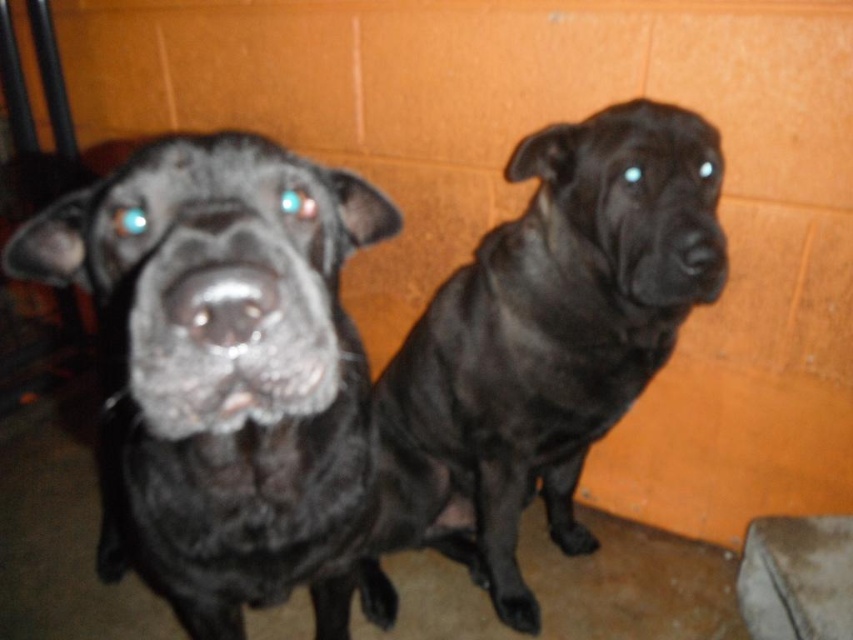
The width and height of the screenshot is (853, 640). I want to click on shiny black dog at left, so click(x=224, y=371).

You are a GUI agent. You are given a task and a screenshot of the screen. Output one action in this format:
    pyautogui.click(x=<x>, y=<y>)
    Task: Click on the shiny black dog at left
    The width and height of the screenshot is (853, 640).
    Given the screenshot: What is the action you would take?
    pos(224,371)